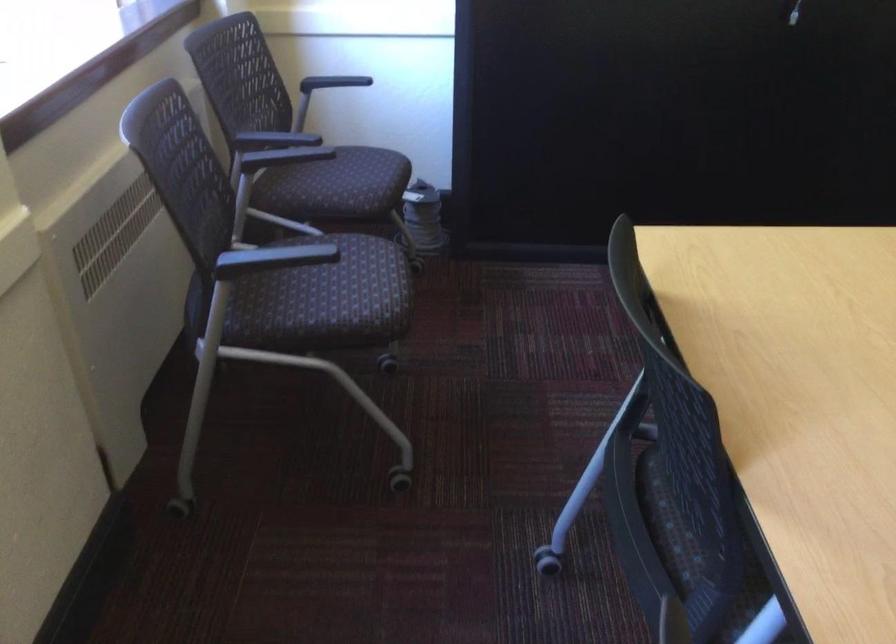
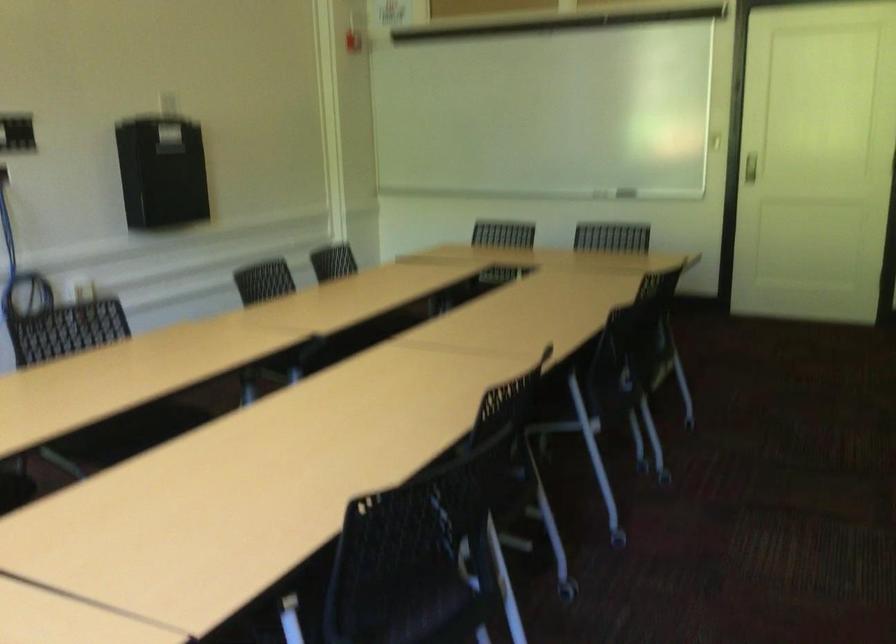
Question: The camera is either moving clockwise (left) or counter-clockwise (right) around the object. The first image is from the beginning of the video and the second image is from the end. Is the camera moving left or right when shooting the video?

Choices:
 (A) Left
 (B) Right

Answer: (A)